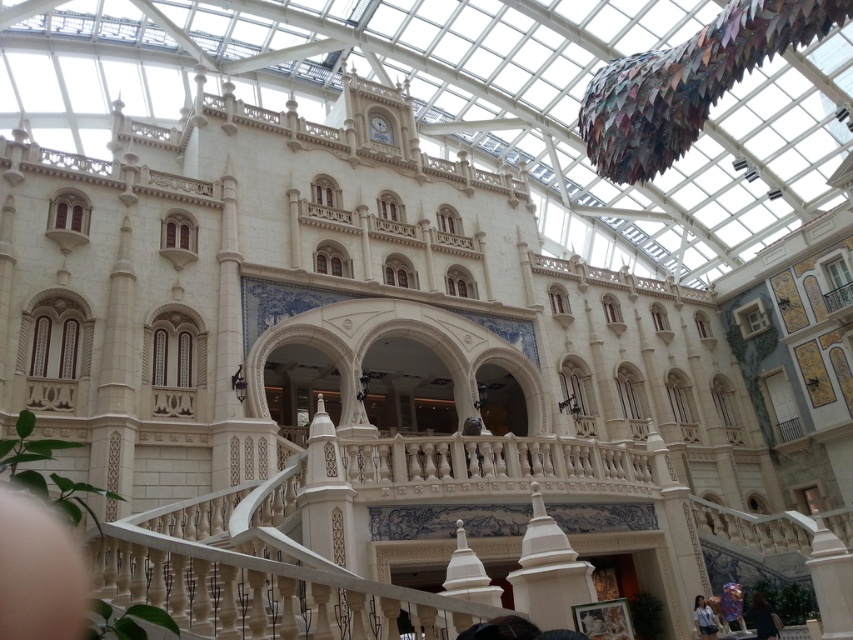
You are a security guard in the grand building and you need to inspect both the dark brown leather jacket at lower right and the light blue denim shirt at lower right. Which one should you check first based on their positions?

You should check the dark brown leather jacket at lower right first because it is closer to you than the light blue denim shirt at lower right.

You are a store employee organizing the clothing section. You see the dark brown leather jacket at lower right and the light blue denim shirt at lower right. Which clothing item is placed on top of the other?

The dark brown leather jacket at lower right is positioned over the light blue denim shirt at lower right, so the jacket is on top of the shirt.